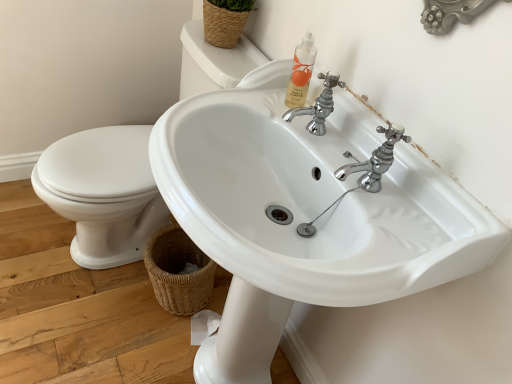
Question: Is white glossy sink at center, which ranks as the 1th sink in left-to-right order, thinner than brown woven basket at lower left, the 2th basket positioned from the top?

Choices:
 (A) yes
 (B) no

Answer: (B)

Question: Does white glossy sink at center, arranged as the second sink when viewed from the right, appear on the right side of brown woven basket at lower left, the 2th basket positioned from the top?

Choices:
 (A) yes
 (B) no

Answer: (B)

Question: From the image's perspective, is white glossy sink at center, arranged as the second sink when viewed from the right, above brown woven basket at lower left, positioned as the first basket in bottom-to-top order?

Choices:
 (A) yes
 (B) no

Answer: (A)

Question: Is white glossy sink at center, which ranks as the 1th sink in left-to-right order, positioned with its back to brown woven basket at lower left, positioned as the first basket in bottom-to-top order?

Choices:
 (A) no
 (B) yes

Answer: (A)

Question: Considering the relative sizes of white glossy sink at center, which ranks as the 1th sink in left-to-right order, and brown woven basket at lower left, positioned as the first basket in bottom-to-top order, in the image provided, is white glossy sink at center, which ranks as the 1th sink in left-to-right order, taller than brown woven basket at lower left, positioned as the first basket in bottom-to-top order,?

Choices:
 (A) yes
 (B) no

Answer: (A)

Question: Is white glossy sink at center, which ranks as the 1th sink in left-to-right order, taller or shorter than woven straw basket at upper center, the 2th basket in the bottom-to-top sequence?

Choices:
 (A) tall
 (B) short

Answer: (A)

Question: Based on their sizes in the image, would you say white glossy sink at center, arranged as the second sink when viewed from the right, is bigger or smaller than woven straw basket at upper center, the first basket viewed from the top?

Choices:
 (A) big
 (B) small

Answer: (A)

Question: In the image, is white glossy sink at center, arranged as the second sink when viewed from the right, on the left side or the right side of woven straw basket at upper center, the first basket viewed from the top?

Choices:
 (A) right
 (B) left

Answer: (B)

Question: From a real-world perspective, is white glossy sink at center, arranged as the second sink when viewed from the right, physically located above or below woven straw basket at upper center, the 2th basket in the bottom-to-top sequence?

Choices:
 (A) below
 (B) above

Answer: (A)

Question: Considering the positions of point pos(329,230) and point pos(203,39), is point pos(329,230) closer or farther from the camera than point pos(203,39)?

Choices:
 (A) closer
 (B) farther

Answer: (A)

Question: Is white glossy sink at center, the second sink positioned from the left, bigger or smaller than white glossy sink at center, arranged as the second sink when viewed from the right?

Choices:
 (A) big
 (B) small

Answer: (A)

Question: Considering their positions, is white glossy sink at center, the second sink positioned from the left, located in front of or behind white glossy sink at center, arranged as the second sink when viewed from the right?

Choices:
 (A) front
 (B) behind

Answer: (A)

Question: Considering the relative positions of white glossy sink at center, the second sink positioned from the left, and white glossy sink at center, which ranks as the 1th sink in left-to-right order, in the image provided, is white glossy sink at center, the second sink positioned from the left, to the left or to the right of white glossy sink at center, which ranks as the 1th sink in left-to-right order,?

Choices:
 (A) left
 (B) right

Answer: (B)

Question: From their relative heights in the image, would you say brown woven basket at lower left, the 2th basket positioned from the top, is taller or shorter than white glossy sink at center, arranged as the second sink when viewed from the right?

Choices:
 (A) short
 (B) tall

Answer: (A)

Question: In terms of size, does brown woven basket at lower left, positioned as the first basket in bottom-to-top order, appear bigger or smaller than white glossy sink at center, arranged as the second sink when viewed from the right?

Choices:
 (A) small
 (B) big

Answer: (A)